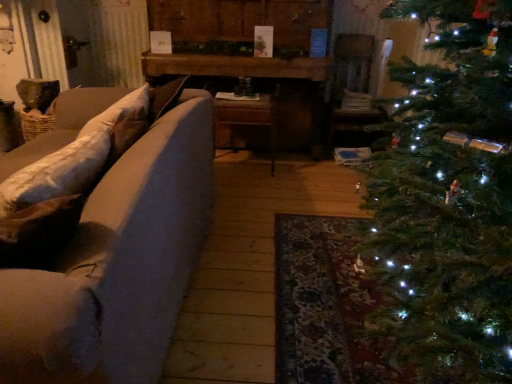
Question: In terms of width, does wooden table at center look wider or thinner when compared to matte gray couch at left?

Choices:
 (A) wide
 (B) thin

Answer: (B)

Question: In the image, is wooden table at center on the left side or the right side of matte gray couch at left?

Choices:
 (A) right
 (B) left

Answer: (A)

Question: From a real-world perspective, is wooden table at center above or below matte gray couch at left?

Choices:
 (A) below
 (B) above

Answer: (B)

Question: Looking at their shapes, would you say matte gray couch at left is wider or thinner than wooden table at center?

Choices:
 (A) wide
 (B) thin

Answer: (A)

Question: Considering the relative positions of matte gray couch at left and wooden table at center in the image provided, is matte gray couch at left to the left or to the right of wooden table at center?

Choices:
 (A) right
 (B) left

Answer: (B)

Question: From a real-world perspective, is matte gray couch at left physically located above or below wooden table at center?

Choices:
 (A) below
 (B) above

Answer: (A)

Question: In the image, is matte gray couch at left positioned in front of or behind wooden table at center?

Choices:
 (A) front
 (B) behind

Answer: (A)